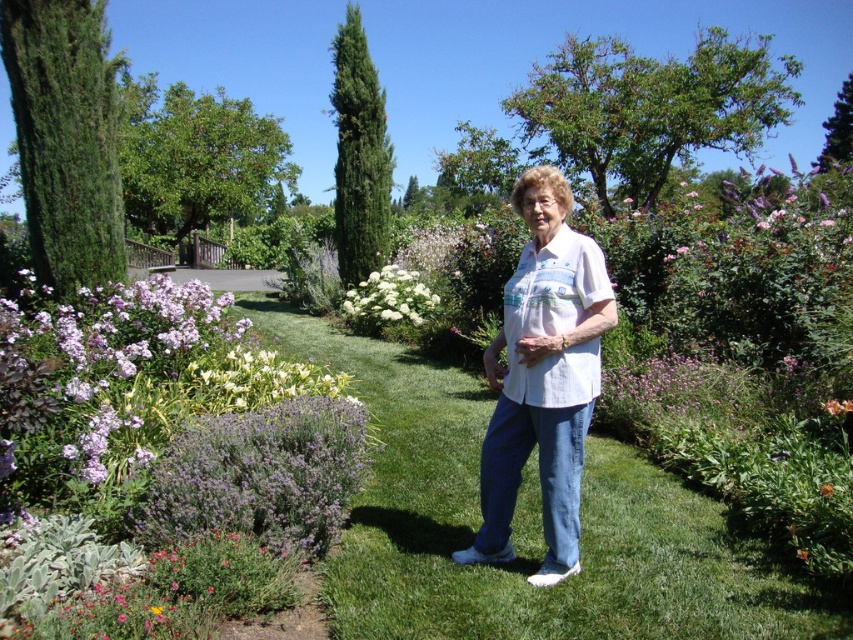
Question: Which of the following is the farthest from the observer?

Choices:
 (A) (781, 589)
 (B) (369, 164)
 (C) (566, 289)
 (D) (817, 490)

Answer: (B)

Question: Among these points, which one is farthest from the camera?

Choices:
 (A) (351, 317)
 (B) (341, 636)

Answer: (A)

Question: Does green needle-like at upper center have a larger size compared to purple matte flower at center?

Choices:
 (A) yes
 (B) no

Answer: (A)

Question: Is white fluffy flower at center positioned before purple matte flower at center?

Choices:
 (A) no
 (B) yes

Answer: (A)

Question: Which of these objects is positioned farthest from the green needle-like at upper center?

Choices:
 (A) purple matte flower at center
 (B) white cotton shirt at center

Answer: (B)

Question: In this image, where is green grass at center located relative to green needle-like at upper center?

Choices:
 (A) below
 (B) above

Answer: (A)